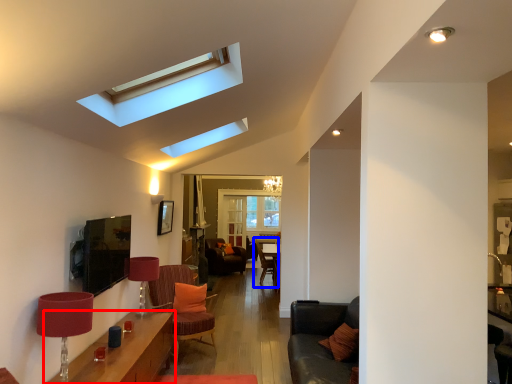
Question: Which point is further to the camera, table (highlighted by a red box) or armchair (highlighted by a blue box)?

Choices:
 (A) table
 (B) armchair

Answer: (B)